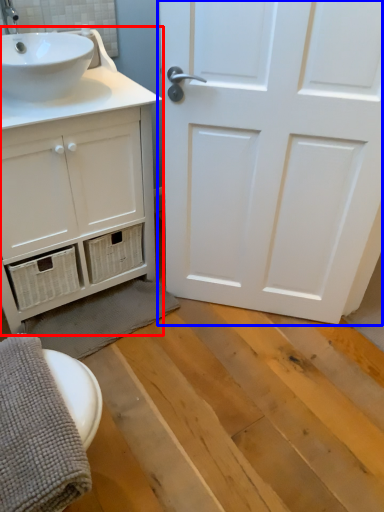
Question: Among these objects, which one is farthest to the camera, bathroom cabinet (highlighted by a red box) or door (highlighted by a blue box)?

Choices:
 (A) bathroom cabinet
 (B) door

Answer: (A)